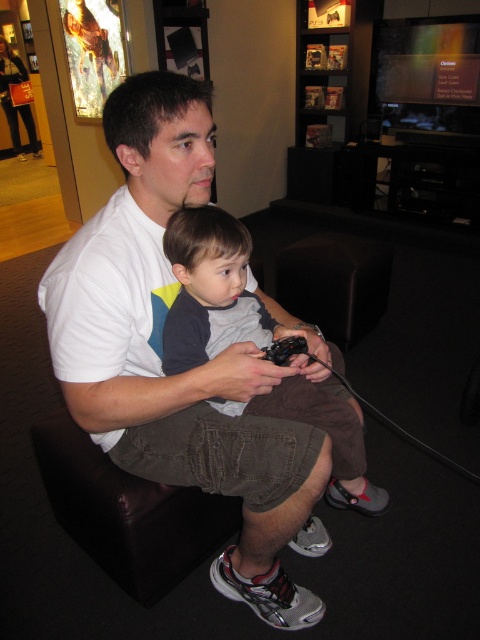
You are a store employee who needs to ensure that the white cotton shirt at center and gray cotton shirt at center can fit side by side on a display rack that is 1.2 meters wide. According to the measurements provided, will both shirts fit comfortably without overlapping?

The white cotton shirt at center is wider than the gray cotton shirt at center. However, since the total width of both shirts combined is not provided, it is impossible to determine if they will fit on the 1.2 meters wide display rack without overlapping.

In the scene shown: You are a customer in the gaming store and you want to buy a shirt for yourself. You see two shirts, a white cotton shirt at center and a gray cotton shirt at center. Which one is located higher on the person wearing them?

The white cotton shirt at center is above the gray cotton shirt at center, so the white cotton shirt at center is located higher.

What is the position of the point with coordinates [160,349] in relation to the white cotton shirt at center?

The point with coordinates [160,349] is located on the white cotton shirt at center.